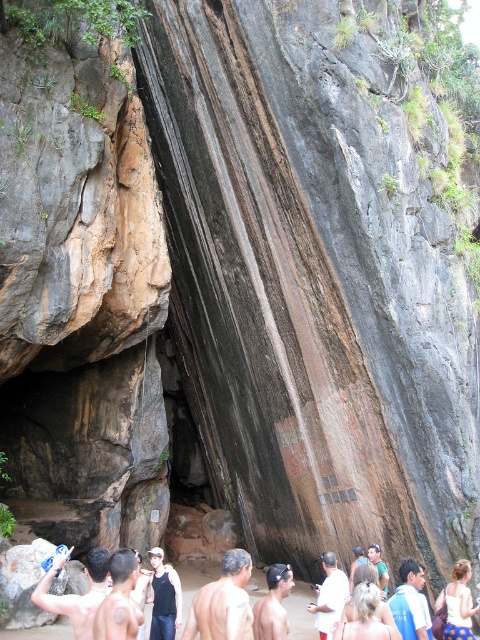
You are standing at the base of the rock formation and see the shiny metallic towel at lower left and the smooth skin man at center. Which object is positioned higher up on the rock formation?

The shiny metallic towel at lower left is located above the smooth skin man at center, so it is positioned higher up on the rock formation.

You are a photographer trying to capture a group photo of the smooth brown skin at center and the smooth skin man at center. To ensure both subjects are in focus, you need to know their relative positions. Which subject is located to the right of the other?

The smooth brown skin at center is positioned on the right side of smooth skin man at center, so the smooth brown skin at center is to the right of the smooth skin man at center.

You are a photographer setting up equipment in the scene. You have the gray hair at lower center and the shiny metallic towel at lower left in your viewfinder. Which object should you zoom in on to capture more details since it is larger?

The gray hair at lower center is bigger than the shiny metallic towel at lower left, so you should zoom in on the gray hair at lower center to capture more details.